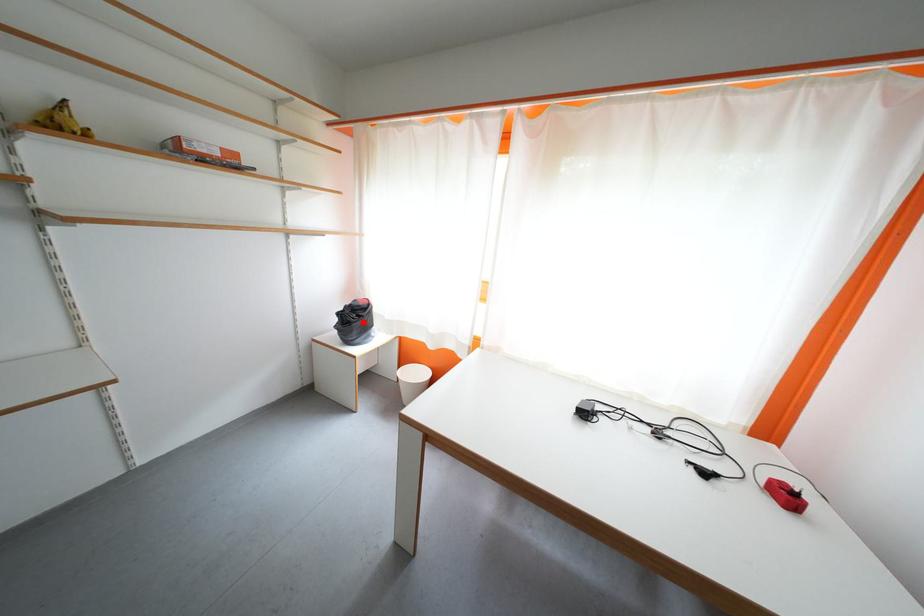
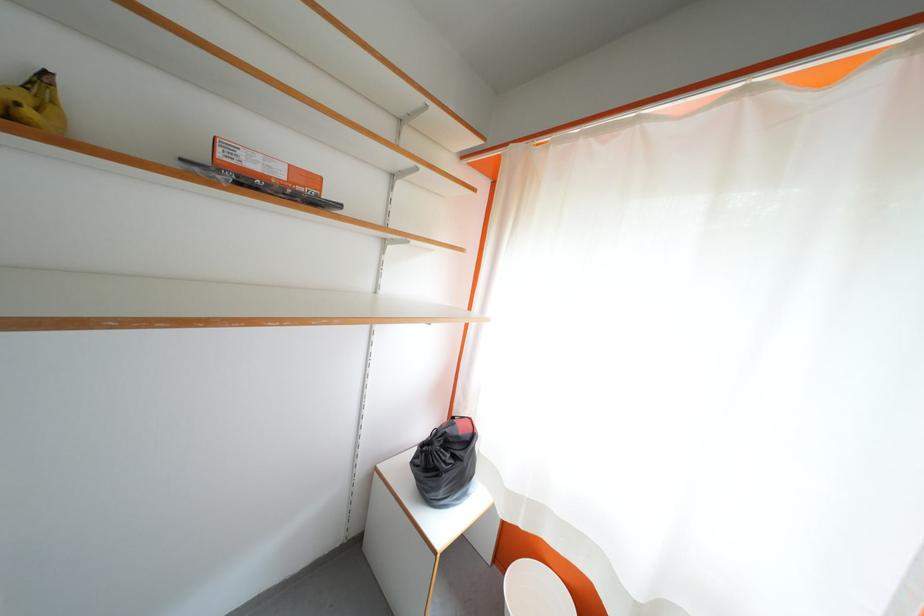
Find the pixel in the second image that matches the highlighted location in the first image.

(455, 460)